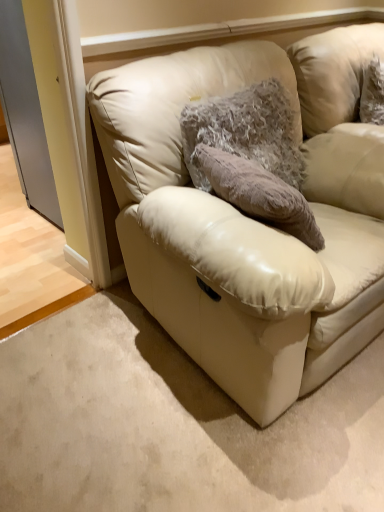
The height and width of the screenshot is (512, 384). I want to click on leather couch at center, so click(249, 218).

Describe the element at coordinates (249, 218) in the screenshot. I see `leather couch at center` at that location.

The width and height of the screenshot is (384, 512). Find the location of `leather couch at center`. leather couch at center is located at coordinates (249, 218).